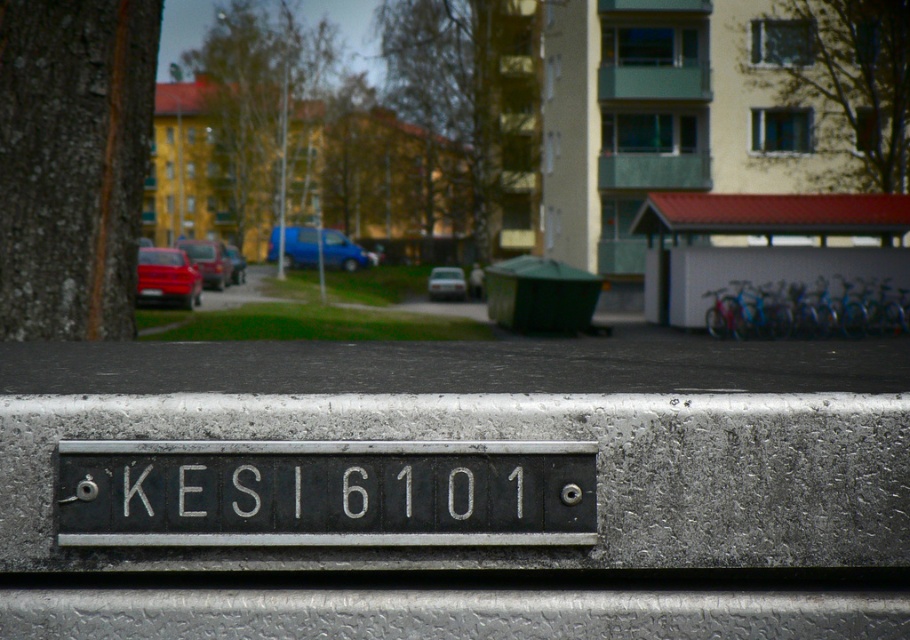
You are standing in front of the plaque on the metallic surface. There are two points marked on the image at coordinates point (366,252) and point (201,268). Which point is closer to you?

Point (201,268) is closer to you because point (366,252) is behind it.

You are taking a photo of the plaque and notice two points on the metallic surface. The first point is at coordinate point [79,540] and the second point is at coordinate point [511,492]. Which point will appear larger in your photo?

Point [79,540] is closer to the camera than point [511,492], so it will appear larger in the photo.

You are a delivery person with a 2.5 meter wide truck that needs to park between the shiny red car at left and the blue matte van at center. Is there enough space for your truck?

The shiny red car at left is 4.60 meters from the blue matte van at center, so yes, the truck can park between them since the distance is wider than the truck.